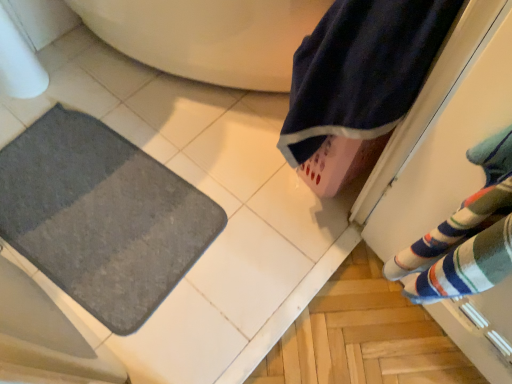
I want to click on free point below gray soft mat at lower left (from a real-world perspective), so click(x=96, y=214).